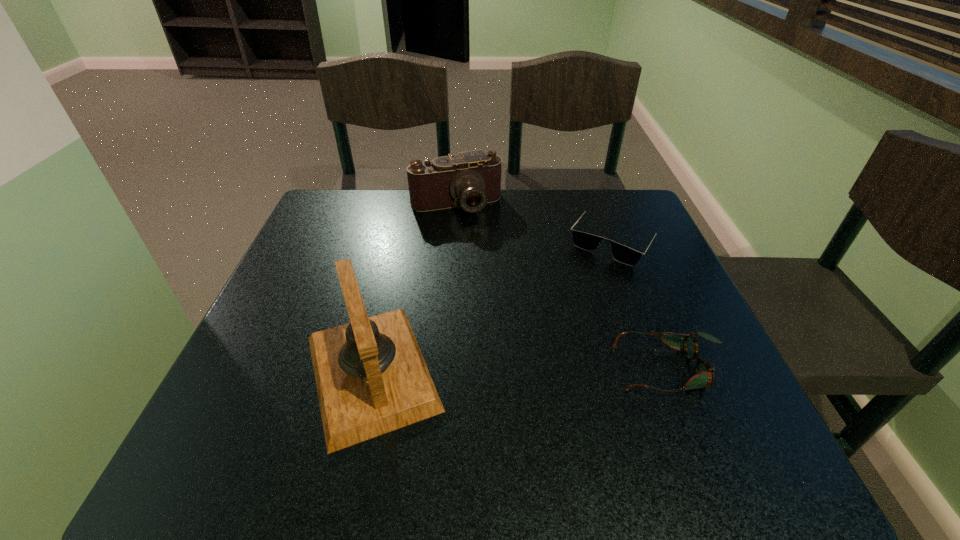
I want to click on vacant position located on the front-facing side of the third shortest object, so click(511, 327).

The image size is (960, 540). Identify the location of free space located 0.080m on the front-facing side of the sunglasses. (583, 284).

Locate an element on the screen. This screenshot has height=540, width=960. vacant space located 0.270m on the front-facing side of the sunglasses is located at coordinates (543, 339).

This screenshot has width=960, height=540. In order to click on free space located 0.320m on the front-facing side of the sunglasses in this screenshot , I will do `click(532, 356)`.

Locate an element on the screen. This screenshot has height=540, width=960. camera that is at the far edge is located at coordinates (470, 179).

Where is `sunglasses located at the far edge`? sunglasses located at the far edge is located at coordinates (588, 242).

Where is `bell at the near edge`? This screenshot has width=960, height=540. bell at the near edge is located at coordinates (371, 378).

Image resolution: width=960 pixels, height=540 pixels. In order to click on spectacles that is at the near edge in this screenshot , I will do `click(704, 372)`.

Locate an element on the screen. object that is at the left edge is located at coordinates (371, 378).

The width and height of the screenshot is (960, 540). What are the coordinates of `spectacles that is positioned at the right edge` in the screenshot? It's located at (704, 372).